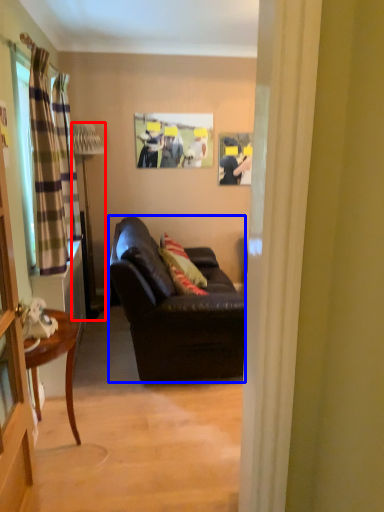
Question: Which object appears closest to the camera in this image, lamp (highlighted by a red box) or studio couch (highlighted by a blue box)?

Choices:
 (A) lamp
 (B) studio couch

Answer: (B)